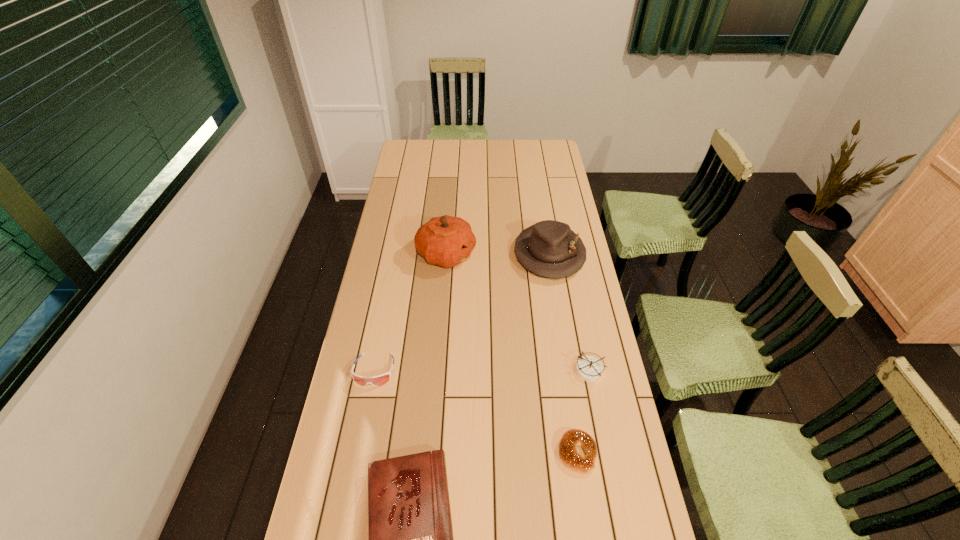
Identify the location of empty space between the compass and the pumpkin. (518, 312).

Where is `free space between the bagel and the tallest object`? This screenshot has height=540, width=960. free space between the bagel and the tallest object is located at coordinates (512, 354).

I want to click on free space between the goggles and the fifth shortest object, so click(x=462, y=313).

Where is `free area in between the compass and the goggles`? The width and height of the screenshot is (960, 540). free area in between the compass and the goggles is located at coordinates [x=482, y=370].

At what (x,y) coordinates should I click in order to perform the action: click on free space between the shortest object and the fifth shortest object. Please return your answer as a coordinate pair (x, y). Looking at the image, I should click on (564, 354).

Locate an element on the screen. object that can be found as the third closest to the hardback book is located at coordinates (590, 369).

Identify which object is located as the fifth nearest to the goggles. Please provide its 2D coordinates. Your answer should be formatted as a tuple, i.e. [(x, y)], where the tuple contains the x and y coordinates of a point satisfying the conditions above.

[(590, 369)]

Identify the location of vacant space that satisfies the following two spatial constraints: 1. on the front-facing side of the shortest object; 2. on the left side of the tallest object. pos(431,453).

Image resolution: width=960 pixels, height=540 pixels. In order to click on free point that satisfies the following two spatial constraints: 1. on the front-facing side of the pumpkin; 2. on the front-facing side of the goggles in this screenshot , I will do click(x=437, y=370).

Identify the location of vacant region that satisfies the following two spatial constraints: 1. on the front-facing side of the shortest object; 2. on the right side of the goggles. This screenshot has width=960, height=540. click(358, 453).